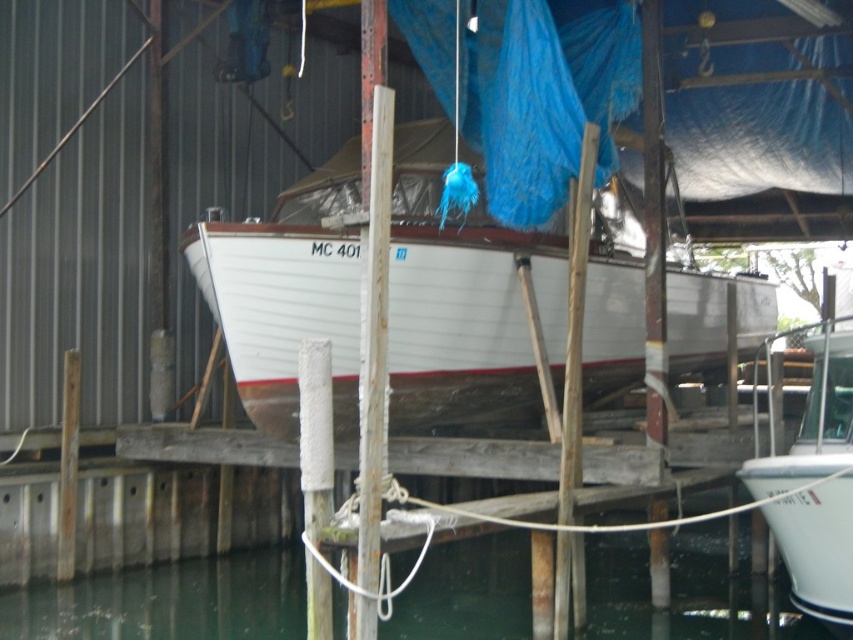
Is white glossy boat at lower right wider than rusty metal pole at center?

Indeed, white glossy boat at lower right has a greater width compared to rusty metal pole at center.

This screenshot has height=640, width=853. What do you see at coordinates (815, 486) in the screenshot?
I see `white glossy boat at lower right` at bounding box center [815, 486].

Who is more distant from viewer, (811, 515) or (373, 436)?

Positioned behind is point (811, 515).

Identify the location of white glossy boat at lower right. (815, 486).

Does greenish water at lower center appear on the left side of white glossy boat at lower right?

Indeed, greenish water at lower center is positioned on the left side of white glossy boat at lower right.

Can you confirm if greenish water at lower center is positioned to the right of white glossy boat at lower right?

Incorrect, greenish water at lower center is not on the right side of white glossy boat at lower right.

Does point (515, 596) lie in front of point (828, 323)?

No.

Where is `greenish water at lower center`? This screenshot has width=853, height=640. greenish water at lower center is located at coordinates (167, 602).

Consider the image. Can you confirm if white wood boat at center is taller than white glossy boat at lower right?

In fact, white wood boat at center may be shorter than white glossy boat at lower right.

Locate an element on the screen. The image size is (853, 640). white wood boat at center is located at coordinates (463, 300).

Which is behind, point (641, 275) or point (819, 390)?

Positioned behind is point (641, 275).

The image size is (853, 640). Identify the location of white wood boat at center. (463, 300).